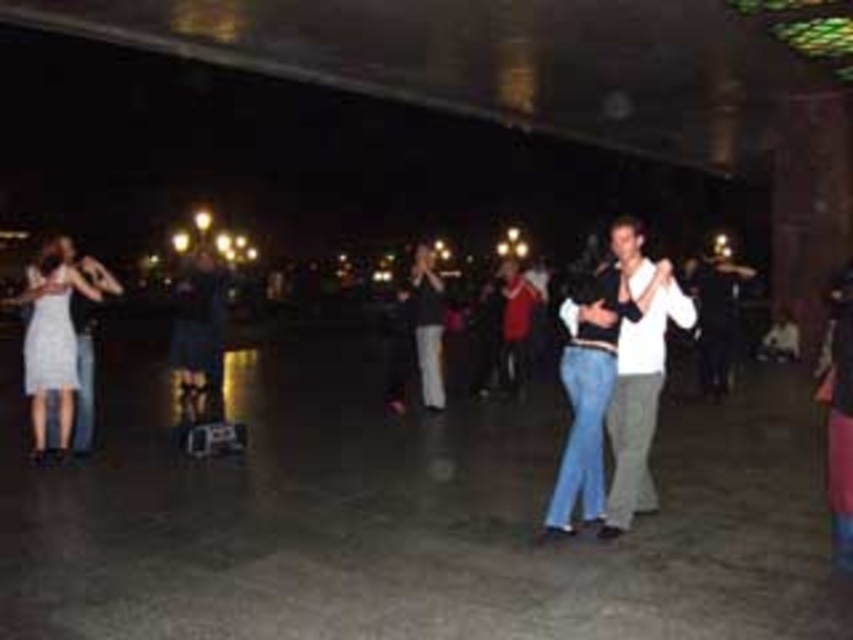
This screenshot has width=853, height=640. What do you see at coordinates (51, 340) in the screenshot?
I see `matte white dress at left` at bounding box center [51, 340].

In the scene shown: Who is lower down, matte white dress at left or matte black dress at center?

matte white dress at left

Identify the location of matte white dress at left. (51, 340).

Between point (625, 328) and point (64, 362), which one is positioned behind?

Positioned behind is point (64, 362).

Who is taller, white matte shirt at center or matte white dress at left?

With more height is white matte shirt at center.

Find the location of a particular element. This screenshot has width=853, height=640. white matte shirt at center is located at coordinates (637, 372).

This screenshot has height=640, width=853. In order to click on white matte shirt at center in this screenshot , I will do `click(637, 372)`.

Is white matte shirt at center shorter than matte black dress at center?

Correct, white matte shirt at center is not as tall as matte black dress at center.

Does white matte shirt at center come in front of matte black dress at center?

Yes, it is.

This screenshot has width=853, height=640. What are the coordinates of `white matte shirt at center` in the screenshot? It's located at (637, 372).